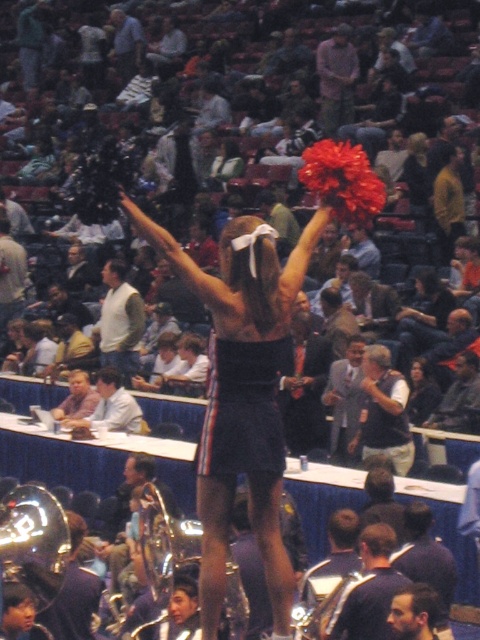
Question: Can you confirm if matte black pom-pom at center is positioned to the left of dark brown hair at center?

Choices:
 (A) yes
 (B) no

Answer: (A)

Question: Can you confirm if matte black pom-pom at center is thinner than white shirt at center?

Choices:
 (A) no
 (B) yes

Answer: (A)

Question: Which object is farther from the camera taking this photo?

Choices:
 (A) dark brown hair at center
 (B) matte black pom-pom at center
 (C) gray vest at center

Answer: (A)

Question: Which of the following is the farthest from the observer?

Choices:
 (A) coord(374,432)
 (B) coord(412,360)

Answer: (B)

Question: Which object is closer to the camera taking this photo?

Choices:
 (A) white shirt at center
 (B) gray vest at center
 (C) dark brown hair at center
 (D) matte black pom-pom at center

Answer: (D)

Question: Is matte black pom-pom at center below white shirt at center?

Choices:
 (A) no
 (B) yes

Answer: (A)